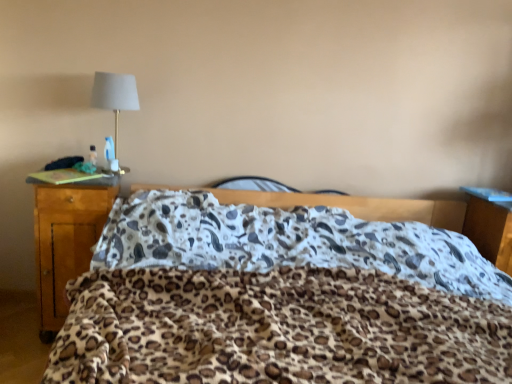
Question: Considering the relative sizes of matte gold lamp at upper left and wooden nightstand at right in the image provided, is matte gold lamp at upper left wider than wooden nightstand at right?

Choices:
 (A) no
 (B) yes

Answer: (A)

Question: Is the depth of matte gold lamp at upper left less than that of wooden nightstand at right?

Choices:
 (A) no
 (B) yes

Answer: (B)

Question: From a real-world perspective, is matte gold lamp at upper left located beneath wooden nightstand at right?

Choices:
 (A) no
 (B) yes

Answer: (A)

Question: Could you tell me if matte gold lamp at upper left is turned towards wooden nightstand at right?

Choices:
 (A) yes
 (B) no

Answer: (B)

Question: Is matte gold lamp at upper left looking in the opposite direction of wooden nightstand at right?

Choices:
 (A) no
 (B) yes

Answer: (A)

Question: Is wooden nightstand at right inside the boundaries of wooden desk at left, or outside?

Choices:
 (A) outside
 (B) inside

Answer: (A)

Question: From a real-world perspective, relative to wooden desk at left, is wooden nightstand at right vertically above or below?

Choices:
 (A) above
 (B) below

Answer: (A)

Question: Looking at their shapes, would you say wooden nightstand at right is wider or thinner than wooden desk at left?

Choices:
 (A) wide
 (B) thin

Answer: (B)

Question: Considering their positions, is wooden nightstand at right located in front of or behind wooden desk at left?

Choices:
 (A) front
 (B) behind

Answer: (B)

Question: Which is correct: matte gold lamp at upper left is inside wooden desk at left, or outside of it?

Choices:
 (A) outside
 (B) inside

Answer: (A)

Question: Considering the relative positions of matte gold lamp at upper left and wooden desk at left in the image provided, is matte gold lamp at upper left to the left or to the right of wooden desk at left?

Choices:
 (A) right
 (B) left

Answer: (A)

Question: From a real-world perspective, is matte gold lamp at upper left physically located above or below wooden desk at left?

Choices:
 (A) below
 (B) above

Answer: (B)

Question: From the image's perspective, is matte gold lamp at upper left above or below wooden desk at left?

Choices:
 (A) above
 (B) below

Answer: (A)

Question: Based on their sizes in the image, would you say wooden nightstand at right is bigger or smaller than leopard print blanket at center?

Choices:
 (A) big
 (B) small

Answer: (B)

Question: Is wooden nightstand at right inside the boundaries of leopard print blanket at center, or outside?

Choices:
 (A) inside
 (B) outside

Answer: (B)